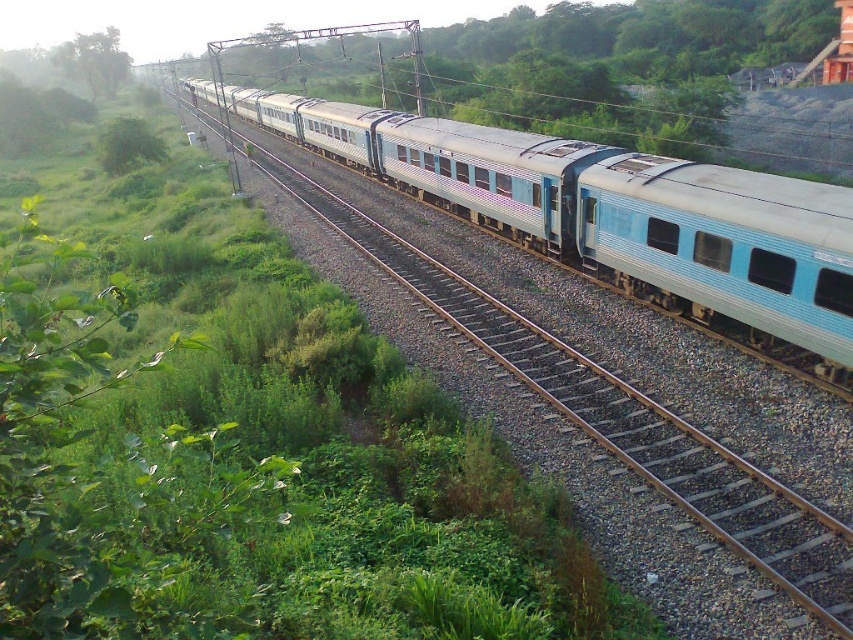
Consider the image. Does light blue metal train at center have a lesser height compared to green leafy tree at upper left?

No.

Based on the photo, measure the distance between light blue metal train at center and camera.

The distance of light blue metal train at center from camera is 41.44 feet.

You are a GUI agent. You are given a task and a screenshot of the screen. Output one action in this format:
    pyautogui.click(x=<x>, y=<y>)
    Task: Click on the light blue metal train at center
    The height and width of the screenshot is (640, 853).
    Given the screenshot: What is the action you would take?
    pyautogui.click(x=612, y=214)